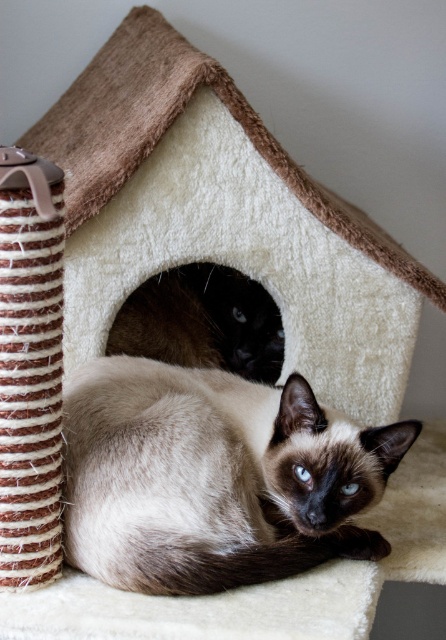
Does smokey brown fur cat at center appear on the right side of smokey brown fur at center?

Incorrect, smokey brown fur cat at center is not on the right side of smokey brown fur at center.

Who is more distant from viewer, (372, 504) or (198, 305)?

Point (198, 305)

Is point (259, 449) farther from viewer compared to point (174, 324)?

No, (259, 449) is in front of (174, 324).

Locate an element on the screen. smokey brown fur cat at center is located at coordinates (214, 477).